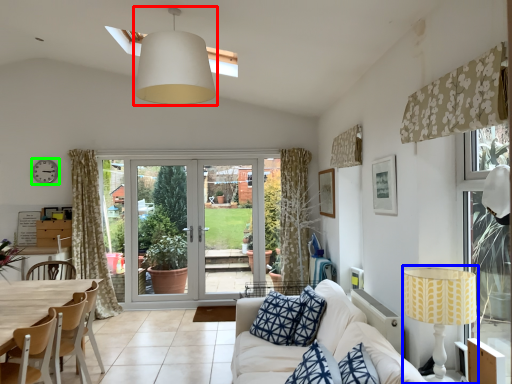
Question: Based on their relative distances, which object is farther from lamp (highlighted by a red box)? Choose from table lamp (highlighted by a blue box) and clock (highlighted by a green box).

Choices:
 (A) table lamp
 (B) clock

Answer: (B)